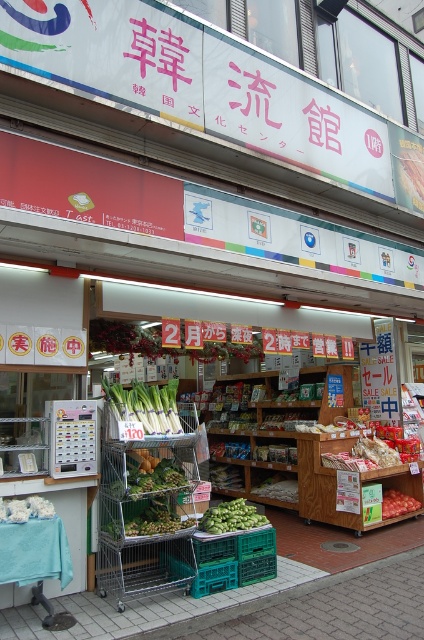
Question: Among these objects, which one is farthest from the camera?

Choices:
 (A) smooth red tomato at center
 (B) green matte eggplant at center

Answer: (A)

Question: Considering the real-world distances, which object is farthest from the green matte leek at center?

Choices:
 (A) green matte eggplant at center
 (B) smooth red tomato at center

Answer: (B)

Question: Which object is farther from the camera taking this photo?

Choices:
 (A) smooth red tomato at center
 (B) green matte eggplant at center
 (C) green matte leek at center

Answer: (A)

Question: Is green matte leek at center to the left of smooth red tomato at center from the viewer's perspective?

Choices:
 (A) no
 (B) yes

Answer: (B)

Question: Is green matte leek at center smaller than smooth red tomato at center?

Choices:
 (A) yes
 (B) no

Answer: (B)

Question: Is green matte eggplant at center wider than smooth red tomato at center?

Choices:
 (A) no
 (B) yes

Answer: (A)